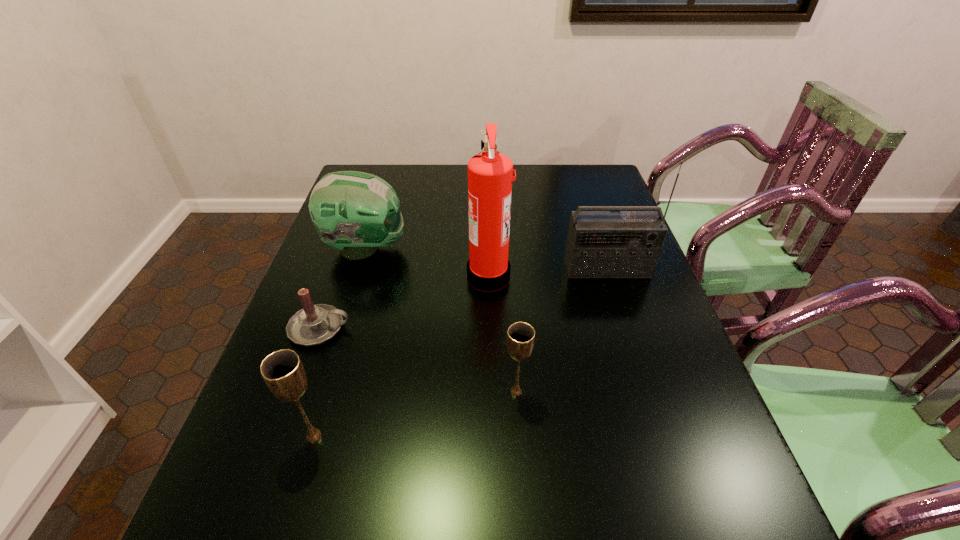
Please show where to add a chalice on the right while keeping spacing even. Please provide its 2D coordinates. Your answer should be formatted as a tuple, i.e. [(x, y)], where the tuple contains the x and y coordinates of a point satisfying the conditions above.

[(688, 354)]